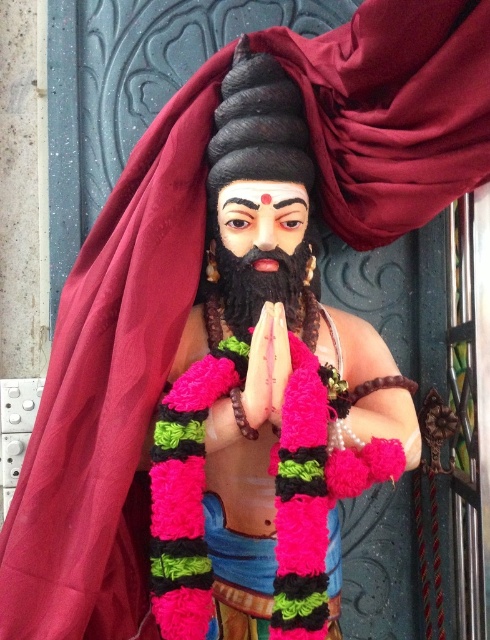
Does polished wood statue at center come behind black matte beard at center?

No, polished wood statue at center is in front of black matte beard at center.

What do you see at coordinates (265, 396) in the screenshot? I see `polished wood statue at center` at bounding box center [265, 396].

Which is in front, point (245, 218) or point (242, 333)?

Positioned in front is point (245, 218).

The height and width of the screenshot is (640, 490). I want to click on polished wood statue at center, so click(265, 396).